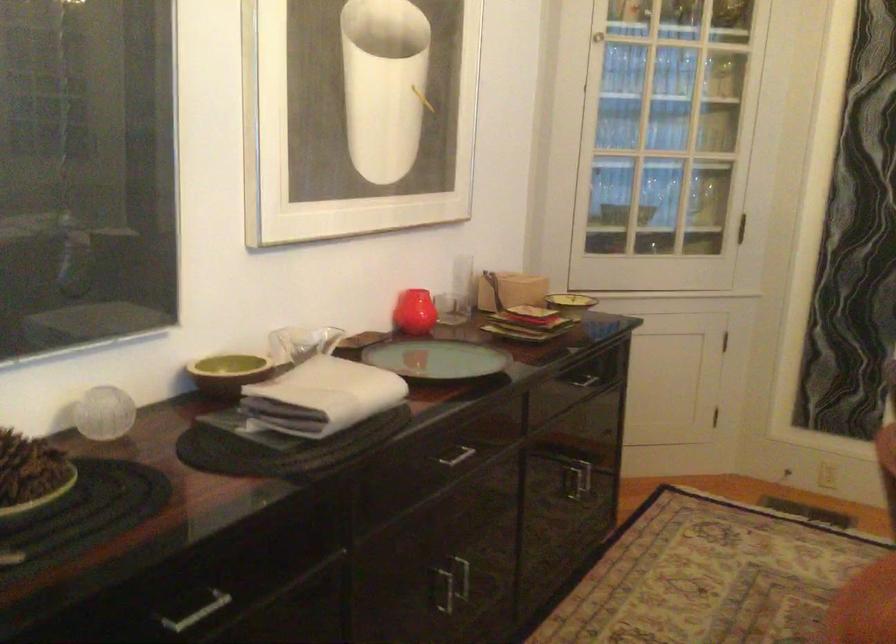
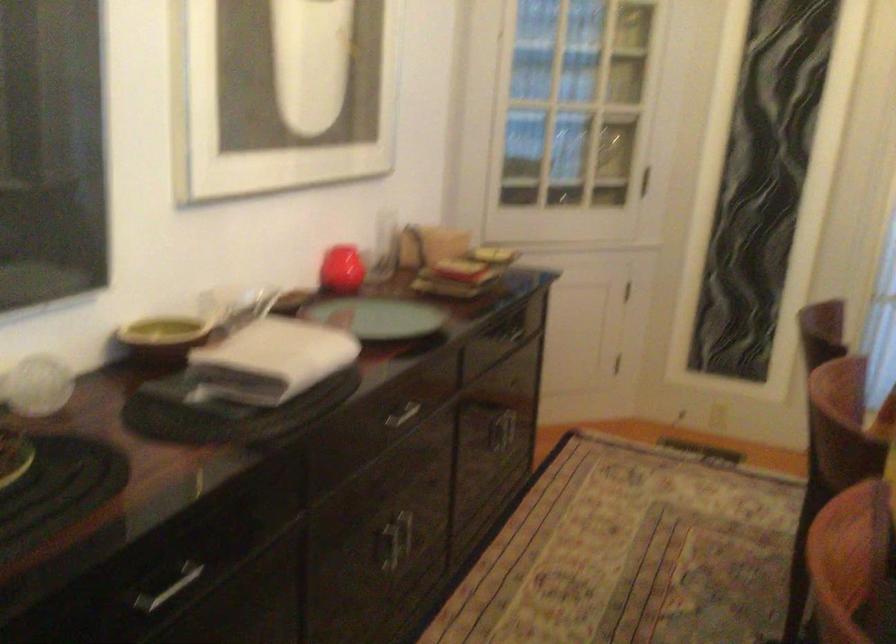
Question: In a continuous first-person perspective shot, in which direction is the camera moving?

Choices:
 (A) Left
 (B) Right
 (C) Forward
 (D) Backward

Answer: (A)